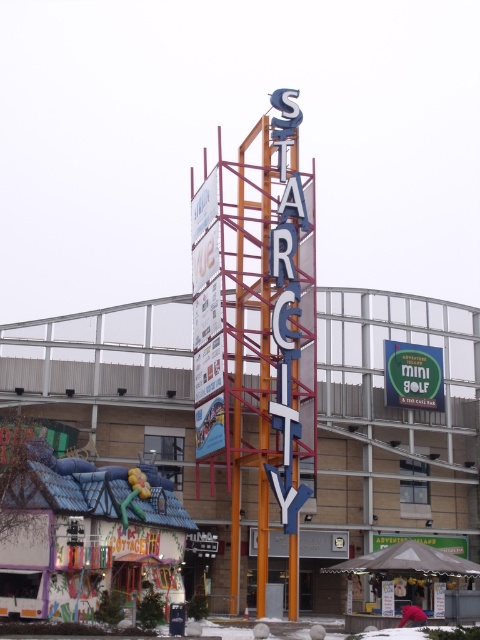
Question: Observing the image, what is the correct spatial positioning of metallic blue sign at center in reference to green matte mini golf sign at center?

Choices:
 (A) below
 (B) above

Answer: (A)

Question: Where is metallic blue sign at center located in relation to green matte mini golf sign at center in the image?

Choices:
 (A) right
 (B) left

Answer: (B)

Question: Is metallic blue sign at center positioned behind green matte mini golf sign at center?

Choices:
 (A) yes
 (B) no

Answer: (B)

Question: Which of the following is the farthest from the observer?

Choices:
 (A) metallic blue sign at center
 (B) green matte mini golf sign at center

Answer: (B)